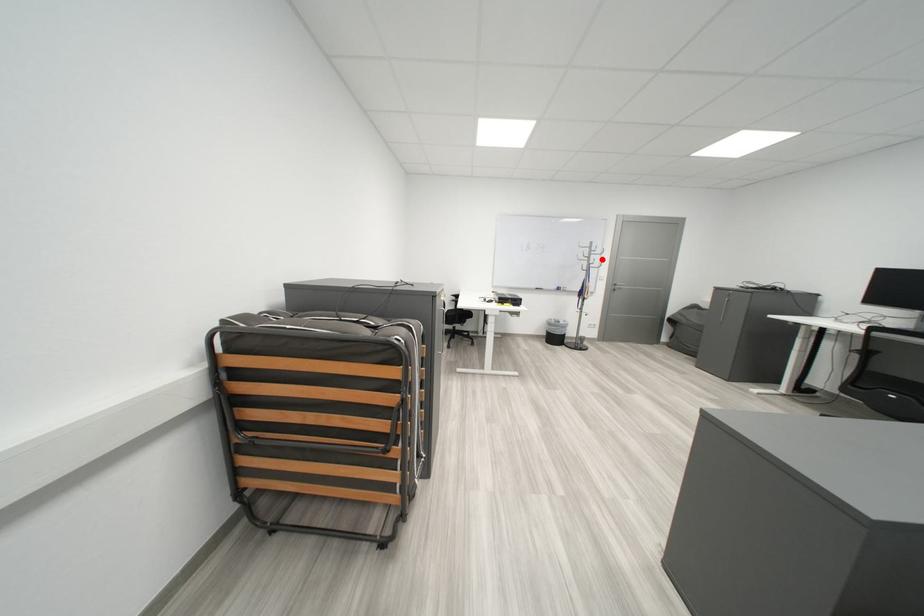
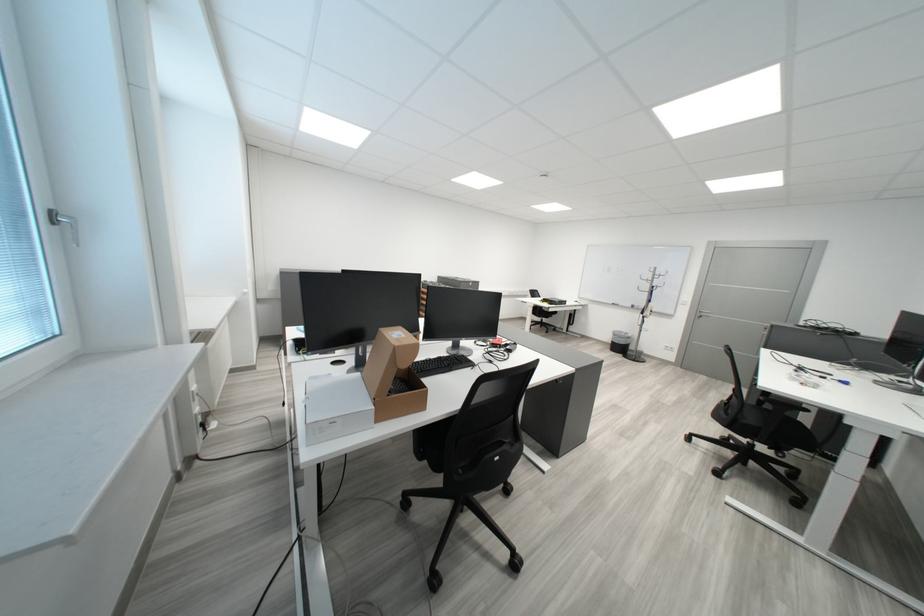
In the second image, find the point that corresponds to the highlighted location in the first image.

(665, 283)